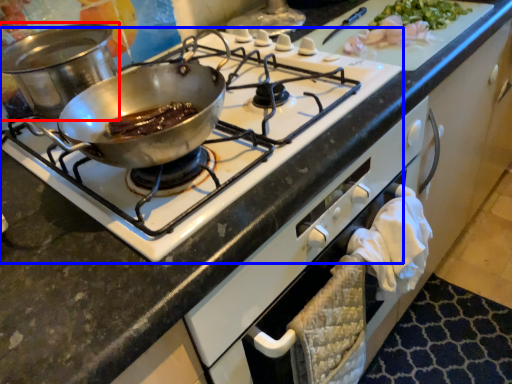
Question: Which point is closer to the camera, kitchen appliance (highlighted by a red box) or gas stove (highlighted by a blue box)?

Choices:
 (A) kitchen appliance
 (B) gas stove

Answer: (B)